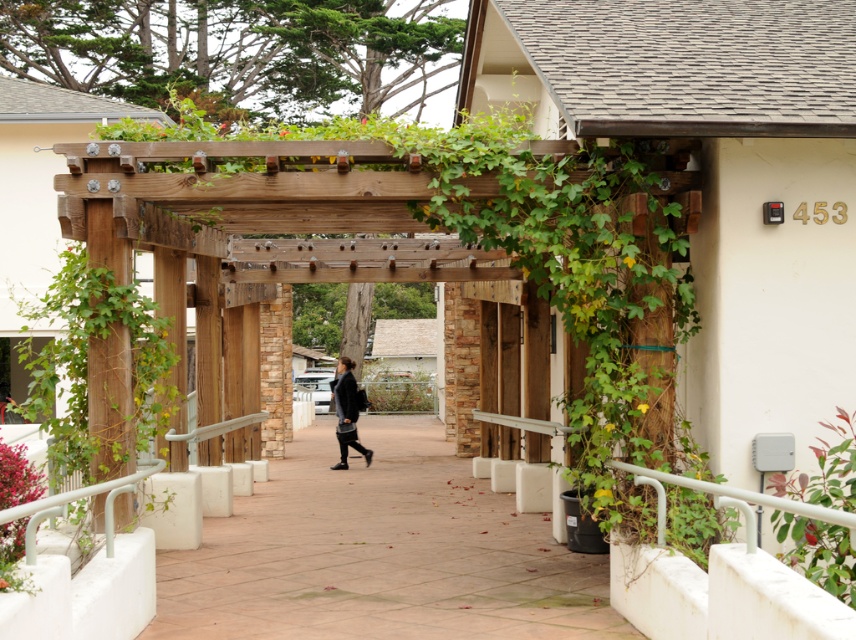
You are a gardener who wants to water the green leafy plant at lower right. You are currently standing on the paved concrete walkway at center. Which direction should you move to reach the plant?

The paved concrete walkway at center is located below the green leafy plant at lower right, so you should move upward to reach the plant.

You are standing at the entrance of the pergola and want to find the green vine at center. According to the coordinates provided, in which direction should you look relative to your position?

The green vine at center is located at coordinates point (88, 365), which places it slightly to the right and lower center from your position at the entrance. Look towards the lower center area to the right to locate it.

You are a delivery person who needs to place a large package on the paved concrete walkway at center and the green leafy plant at lower right. Which location has enough space to accommodate the package without moving any objects?

The paved concrete walkway at center is larger in size than the green leafy plant at lower right, so the paved concrete walkway at center has enough space to accommodate the package without moving any objects.